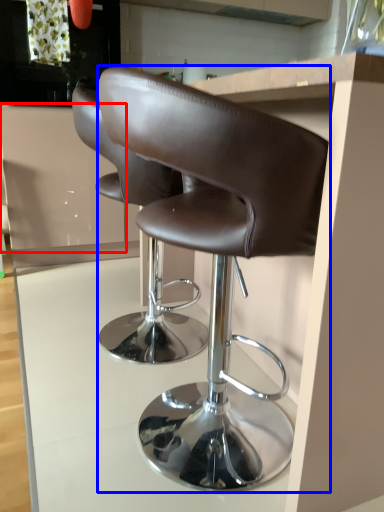
Question: Among these objects, which one is nearest to the camera, cabinetry (highlighted by a red box) or chair (highlighted by a blue box)?

Choices:
 (A) cabinetry
 (B) chair

Answer: (B)